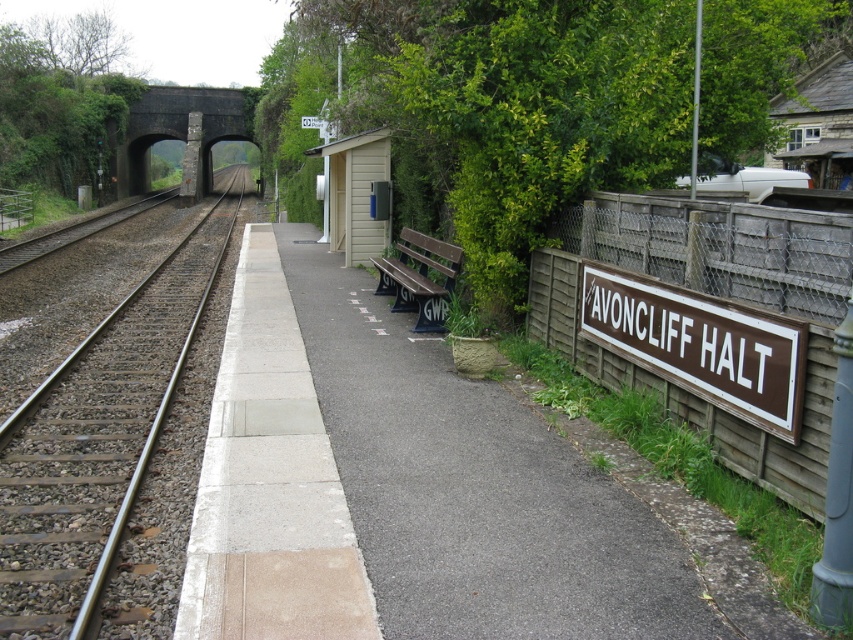
Question: Does smooth metal tracks at center have a lesser width compared to brown wooden sign at right?

Choices:
 (A) yes
 (B) no

Answer: (B)

Question: Estimate the real-world distances between objects in this image. Which object is closer to the brown wooden bench at center?

Choices:
 (A) brown wooden sign at right
 (B) smooth metal tracks at center

Answer: (B)

Question: Which of the following is the closest to the observer?

Choices:
 (A) smooth concrete platform at center
 (B) smooth metal tracks at center
 (C) brown wooden sign at right

Answer: (A)

Question: From the image, what is the correct spatial relationship of smooth metal tracks at center in relation to brown wooden bench at center?

Choices:
 (A) above
 (B) below

Answer: (A)

Question: Is smooth concrete platform at center wider than brown wooden sign at right?

Choices:
 (A) no
 (B) yes

Answer: (B)

Question: Which point appears farthest from the camera in this image?

Choices:
 (A) (434, 292)
 (B) (113, 552)
 (C) (413, 474)

Answer: (A)